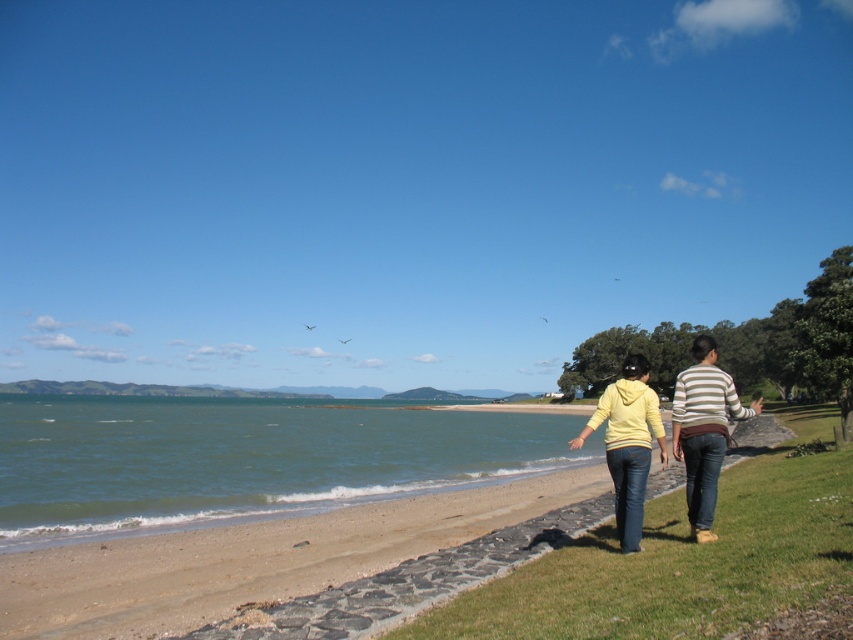
Question: Which point is farther to the camera?

Choices:
 (A) (235, 531)
 (B) (268, 440)
 (C) (712, 438)
 (D) (614, 401)

Answer: (B)

Question: Is yellow hoodie at center thinner than striped sweater at right?

Choices:
 (A) yes
 (B) no

Answer: (B)

Question: Which point is closer to the camera?

Choices:
 (A) (447, 449)
 (B) (637, 529)
 (C) (711, 460)
 (D) (700, 355)

Answer: (B)

Question: Does greenish-blue water at lower left have a smaller size compared to striped sweater at right?

Choices:
 (A) no
 (B) yes

Answer: (A)

Question: Which point appears closest to the camera in this image?

Choices:
 (A) (274, 486)
 (B) (292, 611)
 (C) (695, 436)
 (D) (640, 360)

Answer: (B)

Question: Is striped sweater at right to the right of yellow matte hoodie at lower right from the viewer's perspective?

Choices:
 (A) no
 (B) yes

Answer: (A)